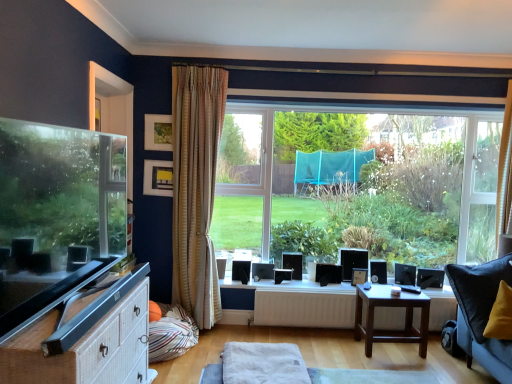
Image resolution: width=512 pixels, height=384 pixels. In order to click on vacant area that lies between striped fabric pillow at lower left and striped fabric curtain at center, positioned as the first curtain in left-to-right order in this screenshot , I will do `click(204, 348)`.